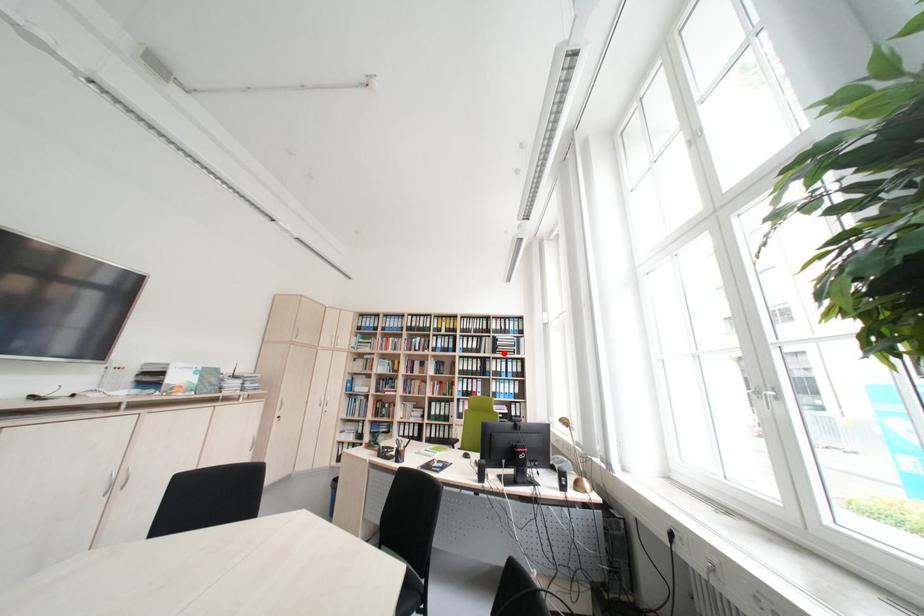
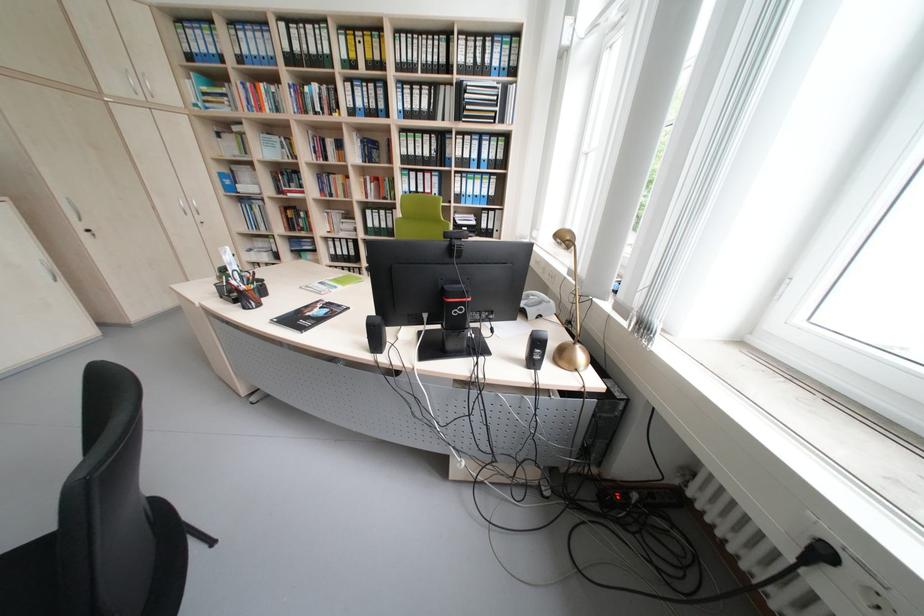
Question: A red point is marked in image1. In image2, is the corresponding 3D point closer to the camera or farther? Reply with the corresponding letter.

Choices:
 (A) The corresponding 3D point is closer.
 (B) The corresponding 3D point is farther.

Answer: (A)